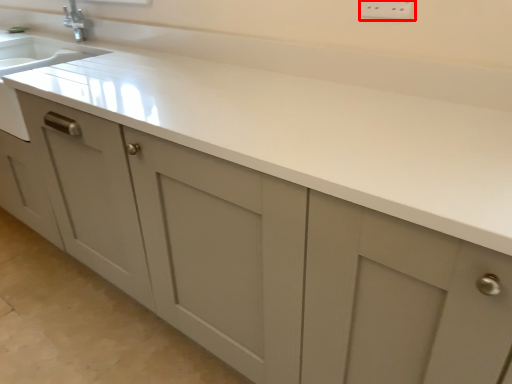
Question: From the image, what is the correct spatial relationship of electric outlet (annotated by the red box) in relation to countertop?

Choices:
 (A) right
 (B) left

Answer: (A)